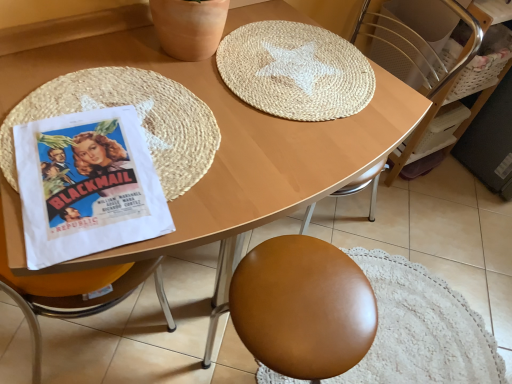
Locate an element on the screen. free space above natural fiber mat at upper center, arranged as the first mat when viewed from the right (from a real-world perspective) is located at coordinates tap(298, 63).